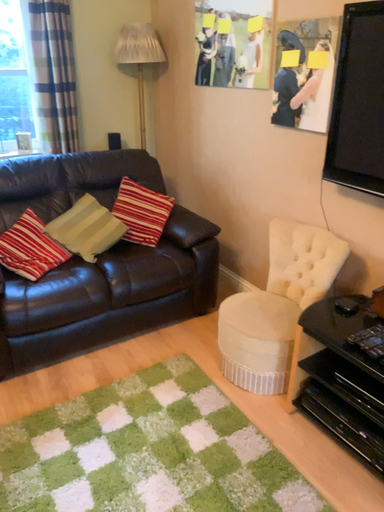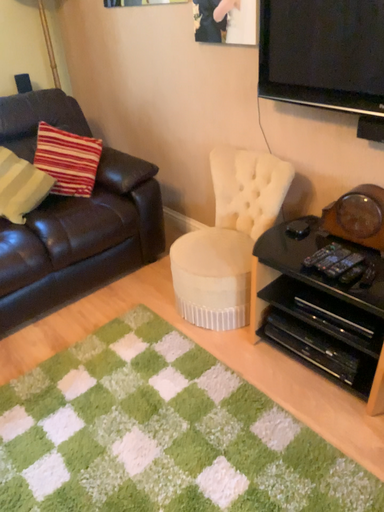
Question: How did the camera likely rotate when shooting the video?

Choices:
 (A) rotated downward
 (B) rotated upward

Answer: (A)